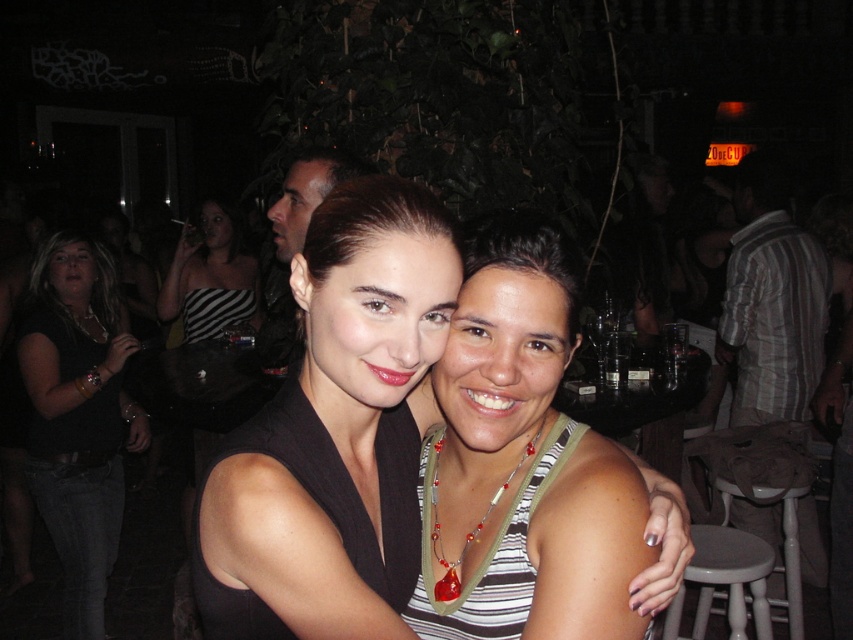
You are a photographer trying to capture a candid shot of the two women in the center of the image. The striped fabric dress at center and the translucent green lanyard at center are both in your viewfinder. Based on their positions, which object is higher up in the frame?

The striped fabric dress at center is above the translucent green lanyard at center, so the striped fabric dress at center is higher up in the frame.

From the picture: You are a photographer at the event and need to capture a photo of both the striped fabric dress at center and the translucent green lanyard at center. Based on their positions, which object should you focus on first to ensure both are in the frame?

The striped fabric dress at center is positioned on the left side of the translucent green lanyard at center. To ensure both are in the frame, focus on the striped fabric dress at center first as it is on the left, then adjust to include the lanyard on the right.